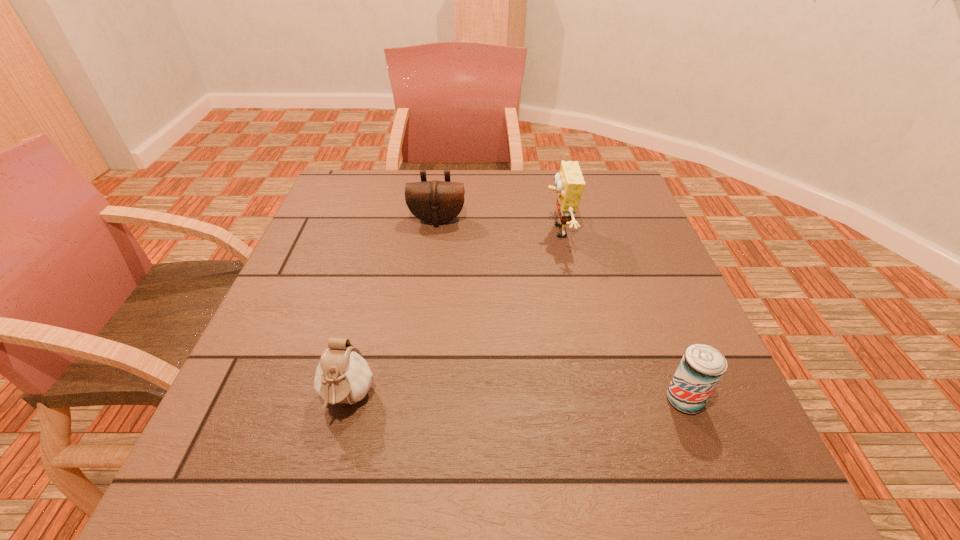
Find the location of a particular element. The width and height of the screenshot is (960, 540). free space located 0.360m on the back of the beer can is located at coordinates (629, 259).

At what (x,y) coordinates should I click in order to perform the action: click on sponge located in the far edge section of the desktop. Please return your answer as a coordinate pair (x, y). Looking at the image, I should click on click(570, 183).

Locate an element on the screen. This screenshot has width=960, height=540. pouch positioned at the far edge is located at coordinates (435, 202).

At what (x,y) coordinates should I click in order to perform the action: click on object that is at the right edge. Please return your answer as a coordinate pair (x, y). The height and width of the screenshot is (540, 960). Looking at the image, I should click on tap(702, 366).

Identify the location of vacant space at the far edge of the desktop. (453, 172).

This screenshot has height=540, width=960. In the image, there is a desktop. What are the coordinates of `blank space at the left edge` in the screenshot? It's located at [333, 216].

The image size is (960, 540). What are the coordinates of `vacant space at the right edge` in the screenshot? It's located at (669, 273).

At what (x,y) coordinates should I click in order to perform the action: click on free space at the near left corner of the desktop. Please return your answer as a coordinate pair (x, y). Looking at the image, I should click on (258, 469).

The image size is (960, 540). What are the coordinates of `vacant space at the far right corner of the desktop` in the screenshot? It's located at coord(625,199).

In order to click on vacant space at the near right corner of the desktop in this screenshot , I will do `click(711, 495)`.